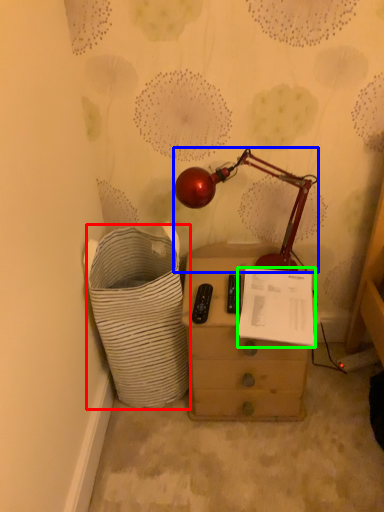
Question: Estimate the real-world distances between objects in this image. Which object is closer to laundry basket (highlighted by a red box), lamp (highlighted by a blue box) or document (highlighted by a green box)?

Choices:
 (A) lamp
 (B) document

Answer: (B)